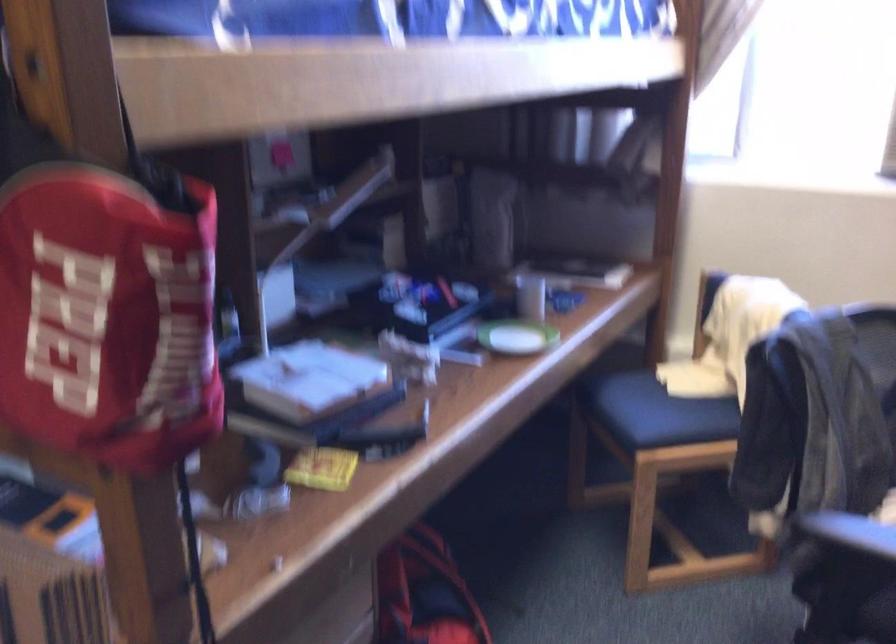
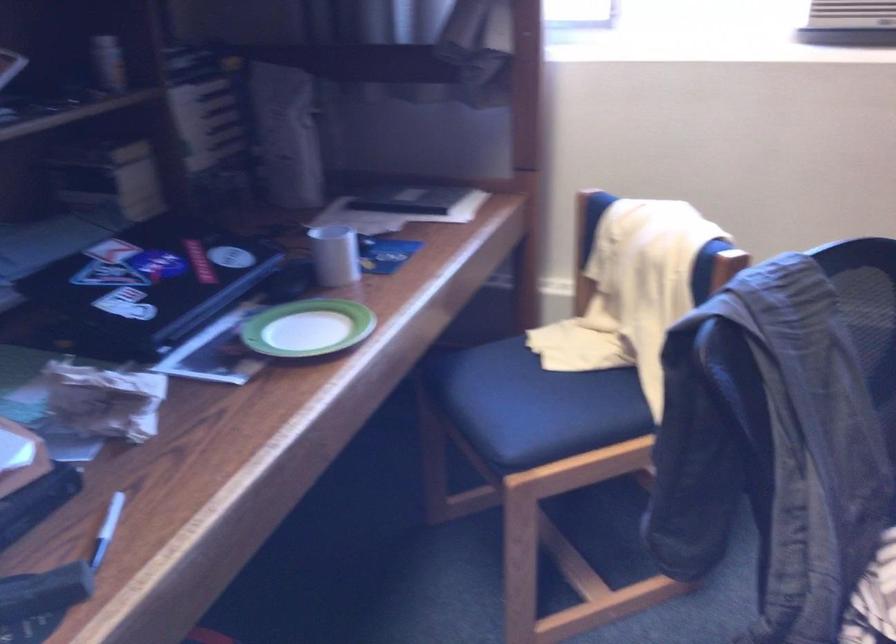
Question: What movement of the cameraman would produce the second image?

Choices:
 (A) Left
 (B) Right
 (C) Forward
 (D) Backward

Answer: (C)